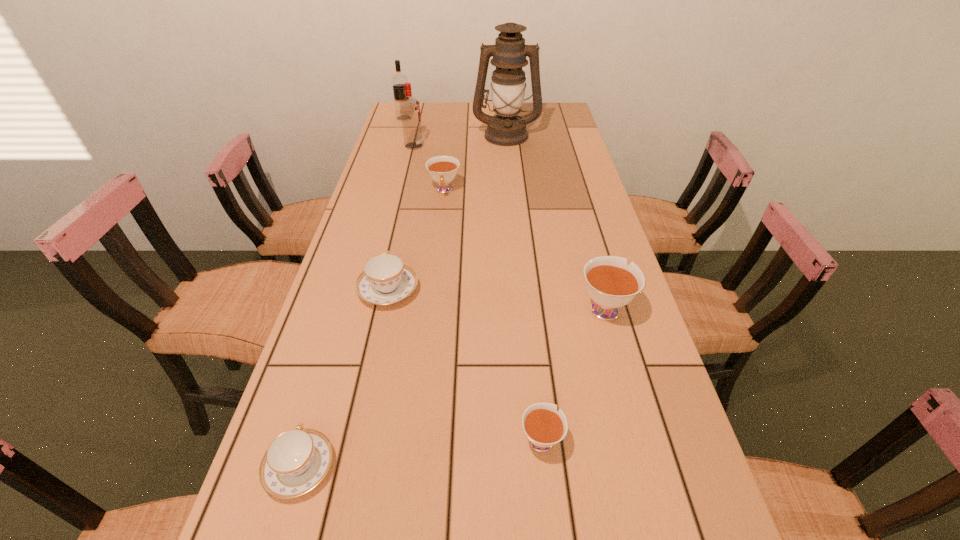
The image size is (960, 540). I want to click on free region located 0.090m on the side with the handle of the farther blue teacup, so click(397, 247).

In order to click on vacant point located 0.230m on the side with the handle of the farther blue teacup in this screenshot , I will do tap(404, 217).

This screenshot has width=960, height=540. In order to click on free space located on the side of the second white teacup from right to left with the handle in this screenshot , I will do `click(530, 338)`.

Where is `vacant space located on the side of the second white teacup from right to left with the handle`? vacant space located on the side of the second white teacup from right to left with the handle is located at coordinates 533,360.

Locate an element on the screen. The image size is (960, 540). vacant space positioned on the side of the second white teacup from right to left with the handle is located at coordinates (524, 281).

This screenshot has width=960, height=540. Find the location of `blank space located on the side with the handle of the smaller blue teacup`. blank space located on the side with the handle of the smaller blue teacup is located at coordinates (350, 298).

Locate an element on the screen. Image resolution: width=960 pixels, height=540 pixels. vacant space positioned on the side with the handle of the smaller blue teacup is located at coordinates (322, 396).

The height and width of the screenshot is (540, 960). I want to click on free region located 0.090m on the side with the handle of the smaller blue teacup, so click(x=323, y=392).

You are a GUI agent. You are given a task and a screenshot of the screen. Output one action in this format:
    pyautogui.click(x=<x>, y=<y>)
    Task: Click on the oil lamp located in the far edge section of the desktop
    This screenshot has width=960, height=540.
    Given the screenshot: What is the action you would take?
    pyautogui.click(x=509, y=53)

Image resolution: width=960 pixels, height=540 pixels. I want to click on vodka at the far edge, so click(x=398, y=80).